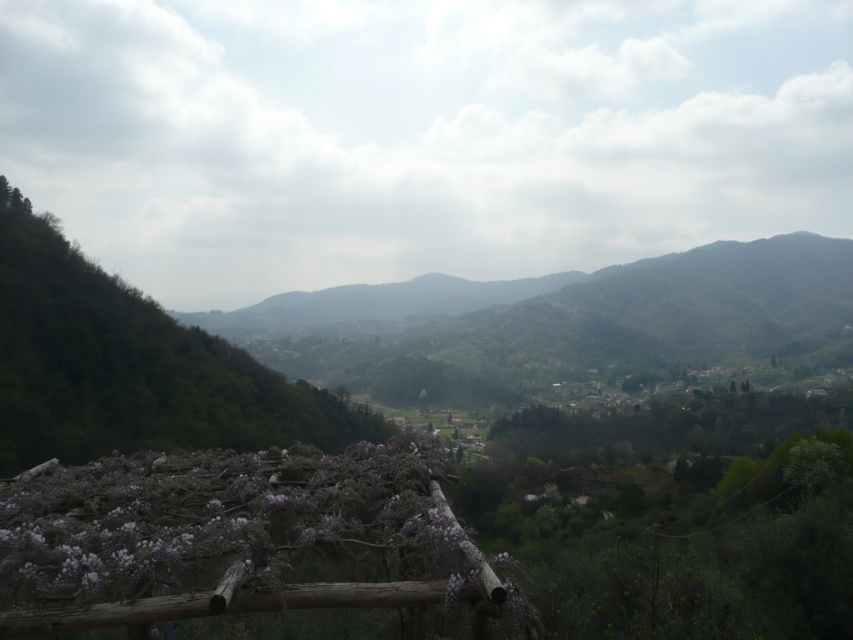
In the scene shown: You are standing at the base of the green leafy mountain at center and want to hike to the top. If your average hiking speed is 3 km per hour, how long would it take to reach the summit?

The distance between the green leafy mountain at center and the viewer is 348.54 meters. Converting this to kilometers gives 0.34854 km. Dividing by the hiking speed of 3 km per hour yields approximately 0.116 hours, which is about 7 minutes. Therefore, it would take roughly 7 minutes to reach the summit.